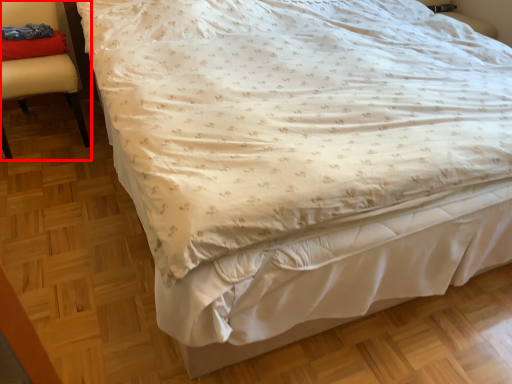
Question: Observing the image, what is the correct spatial positioning of chair (annotated by the red box) in reference to pillow?

Choices:
 (A) right
 (B) left

Answer: (B)